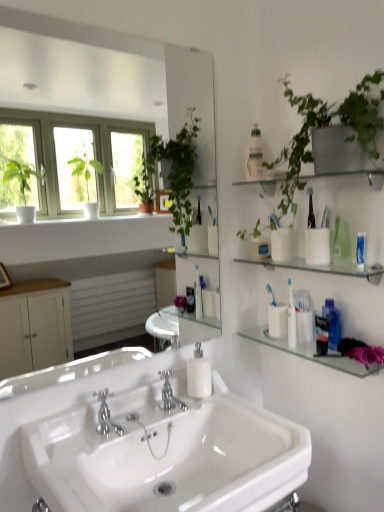
Question: From a real-world perspective, is clear glass shelf at upper right, which appears as the second shelf when ordered from the bottom, physically located above or below clear glass mirror at upper center?

Choices:
 (A) below
 (B) above

Answer: (A)

Question: Visually, is clear glass shelf at upper right, which appears as the second shelf when ordered from the bottom, positioned to the left or to the right of clear glass mirror at upper center?

Choices:
 (A) right
 (B) left

Answer: (A)

Question: Which of these objects is positioned farthest from the white glossy sink at center?

Choices:
 (A) clear glass shelf at upper right, the 1th shelf positioned from the top
 (B) chrome metallic faucet at center, which ranks as the first tap in left-to-right order
 (C) white plastic bottle at upper center, which is the 2th toiletry in bottom-to-top order
 (D) white matte cup at right, marked as the first toiletry in a right-to-left arrangement
 (E) white matte soap dispenser at center

Answer: (C)

Question: Which is nearer to the white plastic bottle at upper center, positioned as the 1th toiletry in left-to-right order?

Choices:
 (A) clear glass shelf at upper right, the third shelf from the bottom
 (B) clear glass shelf at upper right, which appears as the second shelf when viewed from the top
 (C) white matte soap dispenser at center
 (D) chrome metallic faucet at center, arranged as the 2th tap when viewed from the back
 (E) white matte cup at right, marked as the 2th toiletry in a top-to-bottom arrangement

Answer: (A)